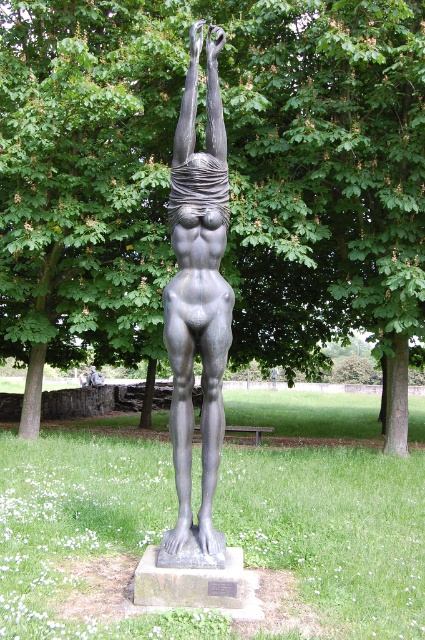
You are standing in the park and see the green leafy tree at center and the matte bronze statue at center. Which object is positioned to the left?

The green leafy tree at center is to the left of the matte bronze statue at center.